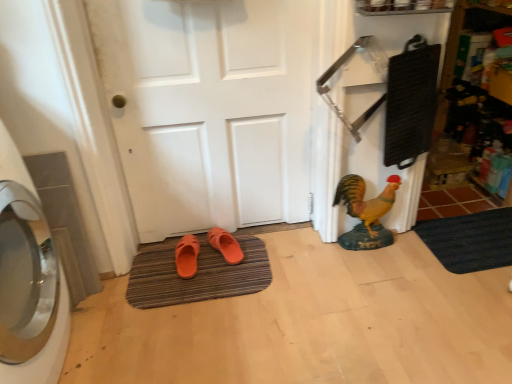
The height and width of the screenshot is (384, 512). Identify the location of free point in front of orange matte slippers at center, the 1th footwear viewed from the right. (224, 282).